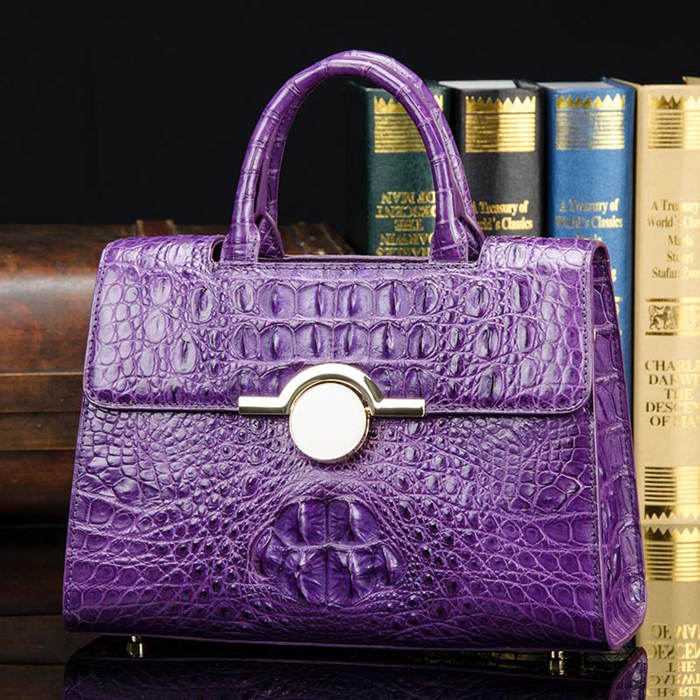
You are a GUI agent. You are given a task and a screenshot of the screen. Output one action in this format:
    pyautogui.click(x=<x>, y=<y>)
    Task: Click on the black book cover
    
    Given the screenshot: What is the action you would take?
    pyautogui.click(x=512, y=183)